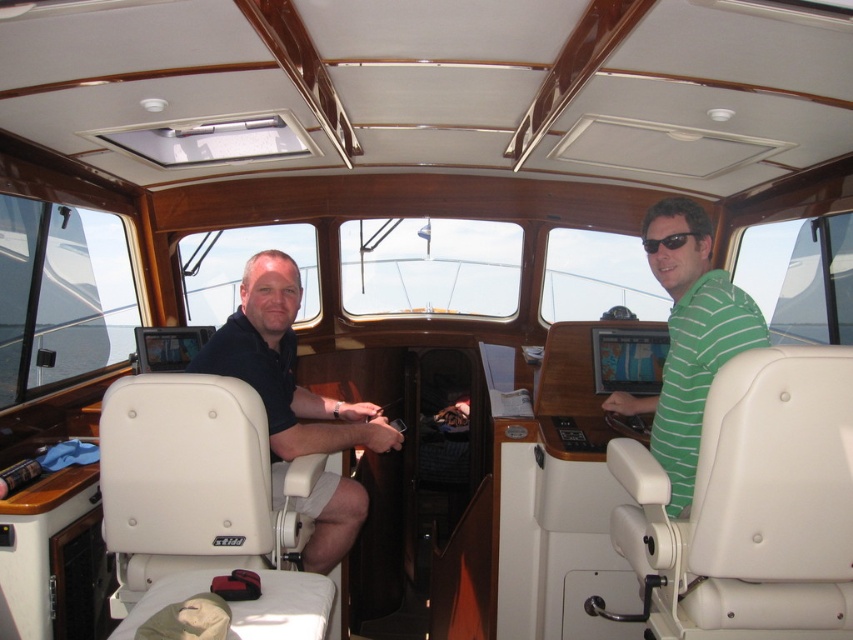
Question: Considering the relative positions of green striped shirt at right and black plastic sunglasses at center in the image provided, where is green striped shirt at right located with respect to black plastic sunglasses at center?

Choices:
 (A) left
 (B) right

Answer: (B)

Question: Among these objects, which one is nearest to the camera?

Choices:
 (A) white leather seat at center
 (B) black plastic sunglasses at center

Answer: (A)

Question: Does white leather seat at center have a lesser width compared to black plastic sunglasses at center?

Choices:
 (A) yes
 (B) no

Answer: (B)

Question: Does white leather seat at center lie in front of black plastic sunglasses at center?

Choices:
 (A) yes
 (B) no

Answer: (A)

Question: Among these points, which one is nearest to the camera?

Choices:
 (A) (279, 445)
 (B) (672, 243)
 (C) (257, 536)

Answer: (C)

Question: Which of these objects is positioned closest to the black plastic sunglasses at center?

Choices:
 (A) dark blue shirt at left
 (B) green striped shirt at right
 (C) white leather seat at center

Answer: (B)